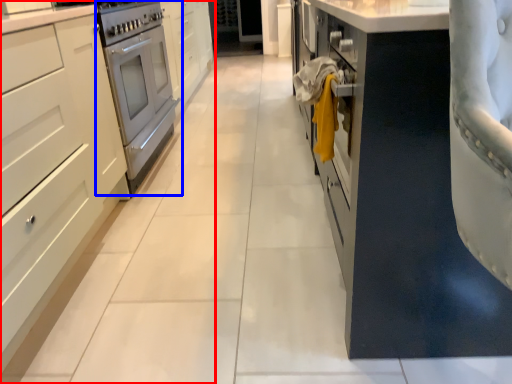
Question: Which of the following is the closest to the observer, cabinetry (highlighted by a red box) or home appliance (highlighted by a blue box)?

Choices:
 (A) cabinetry
 (B) home appliance

Answer: (A)